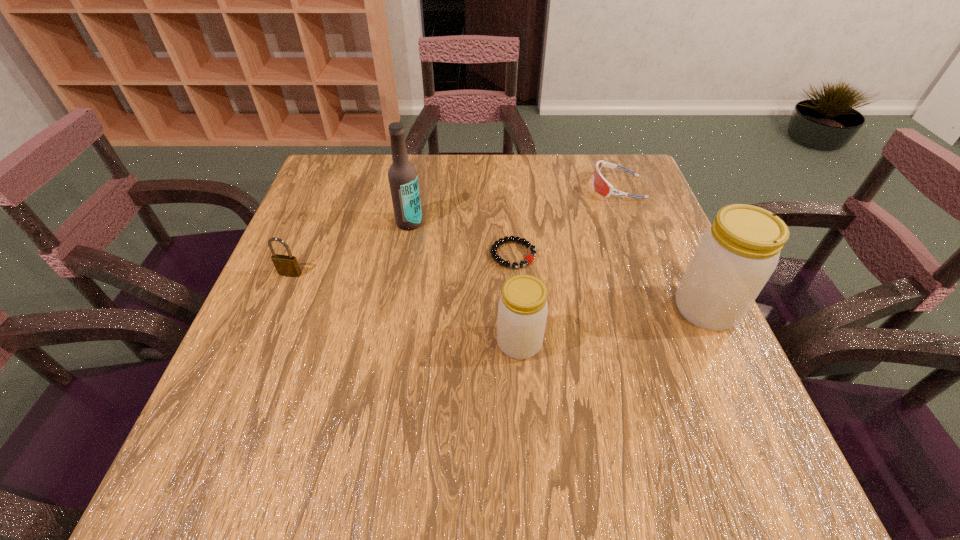
The height and width of the screenshot is (540, 960). In order to click on the second closest object to the bracelet in this screenshot , I will do `click(402, 175)`.

Find the location of `object that is the fourth closest to the third shortest object`. object that is the fourth closest to the third shortest object is located at coordinates (600, 184).

At what (x,y) coordinates should I click in order to perform the action: click on vacant position in the image that satisfies the following two spatial constraints: 1. on the back side of the bracelet; 2. on the right side of the left jar. Please return your answer as a coordinate pair (x, y). The height and width of the screenshot is (540, 960). Looking at the image, I should click on (513, 255).

Identify the location of vacant point that satisfies the following two spatial constraints: 1. on the side of the fifth object from right to left with the label; 2. on the right side of the left jar. This screenshot has height=540, width=960. (389, 343).

Locate an element on the screen. vacant region that satisfies the following two spatial constraints: 1. on the side of the bracelet with the label; 2. on the left side of the beer bottle is located at coordinates (404, 255).

At what (x,y) coordinates should I click in order to perform the action: click on vacant space that satisfies the following two spatial constraints: 1. on the front side of the fourth tallest object; 2. on the left side of the left jar. Please return your answer as a coordinate pair (x, y). The height and width of the screenshot is (540, 960). Looking at the image, I should click on (261, 343).

Where is `free space that satisfies the following two spatial constraints: 1. on the side of the left jar with the label; 2. on the right side of the fifth nearest object`? free space that satisfies the following two spatial constraints: 1. on the side of the left jar with the label; 2. on the right side of the fifth nearest object is located at coordinates (389, 343).